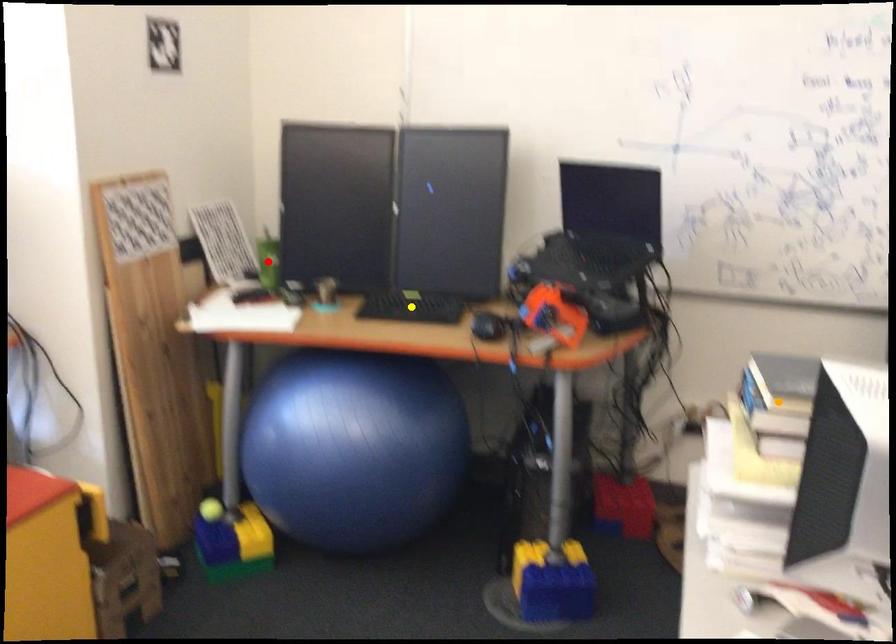
Order these from nearest to farthest:
yellow point, red point, orange point

orange point, yellow point, red point